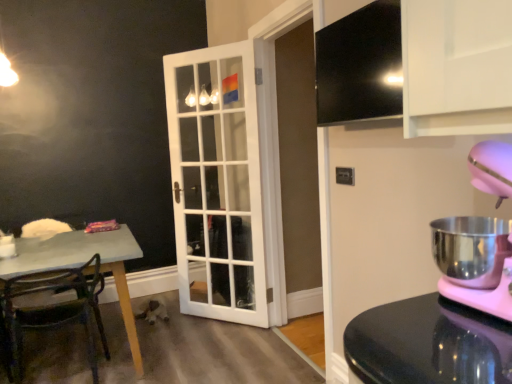
Question: Relative to white glass door at center, is white glossy coffee cup at lower left in front or behind?

Choices:
 (A) behind
 (B) front

Answer: (B)

Question: In terms of width, does white glossy coffee cup at lower left look wider or thinner when compared to white glass door at center?

Choices:
 (A) wide
 (B) thin

Answer: (B)

Question: Which object is positioned closest to the black glossy exhaust hood at upper right?

Choices:
 (A) metallic green chair at left
 (B) white glossy coffee cup at lower left
 (C) pink plastic mixer at right
 (D) white glass door at center

Answer: (C)

Question: Considering the real-world distances, which object is closest to the pink plastic mixer at right?

Choices:
 (A) white glass door at center
 (B) metallic green chair at left
 (C) black glossy exhaust hood at upper right
 (D) white glossy coffee cup at lower left

Answer: (C)